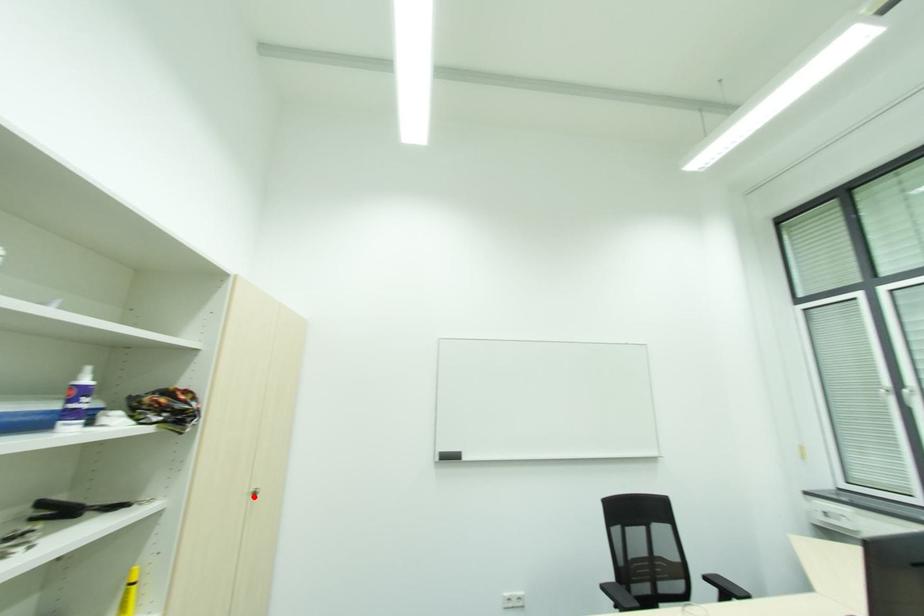
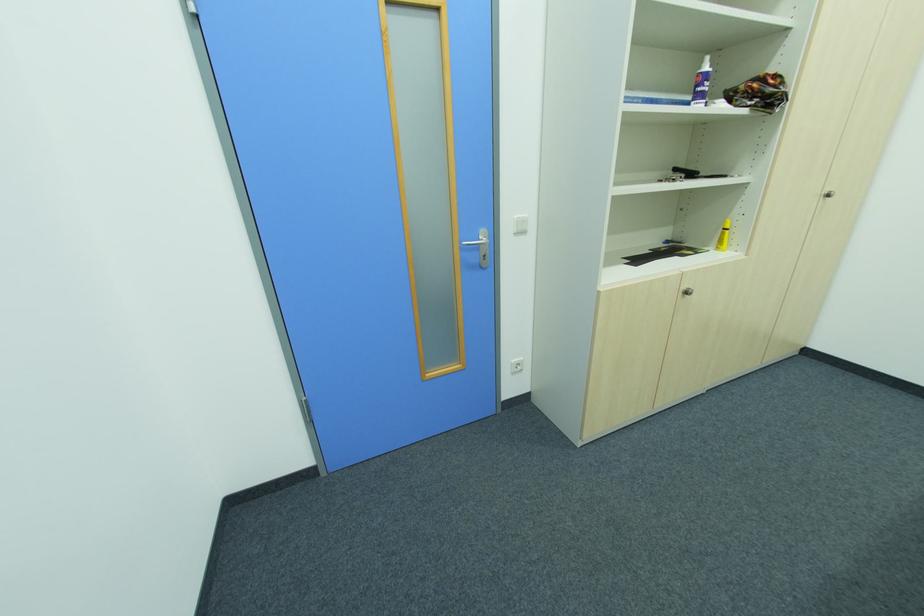
Locate, in the second image, the point that corresponds to the highlighted location in the first image.

(822, 198)